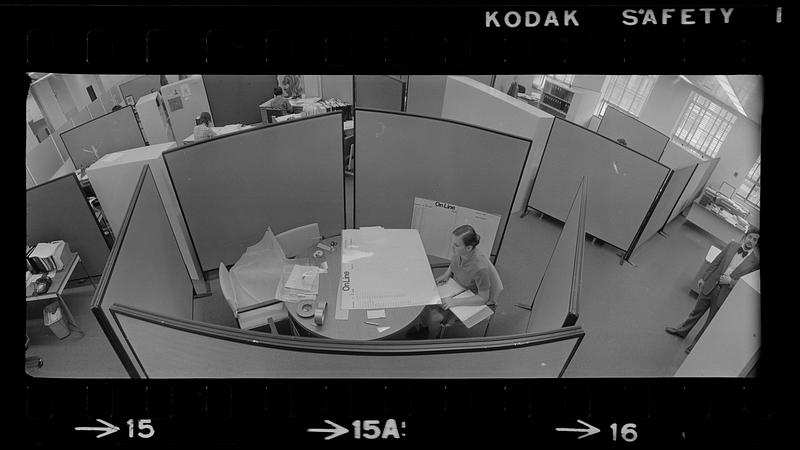
The image size is (800, 450). In order to click on desk in this screenshot , I will do `click(720, 215)`.